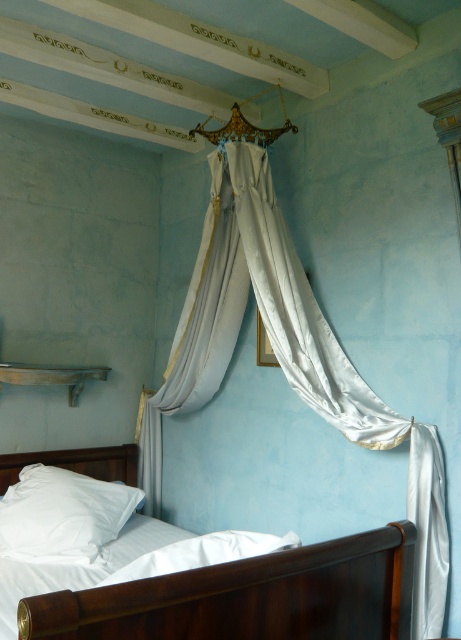
Question: In this image, where is satin white bed at upper center located relative to white satin pillow at lower left?

Choices:
 (A) left
 (B) right

Answer: (B)

Question: Does white satin pillow at lower left appear on the left side of white matte headboard at lower left?

Choices:
 (A) yes
 (B) no

Answer: (B)

Question: Does white satin pillow at lower left appear on the right side of white matte headboard at lower left?

Choices:
 (A) no
 (B) yes

Answer: (B)

Question: Which point appears farthest from the camera in this image?

Choices:
 (A) (57, 499)
 (B) (89, 467)
 (C) (426, 548)
 (D) (309, 570)

Answer: (B)

Question: Which point is farther to the camera?

Choices:
 (A) (23, 520)
 (B) (35, 452)

Answer: (B)

Question: Among these objects, which one is farthest from the camera?

Choices:
 (A) satin white curtain at upper center
 (B) satin white bed at upper center
 (C) white matte headboard at lower left
 (D) white satin pillow at lower left

Answer: (C)